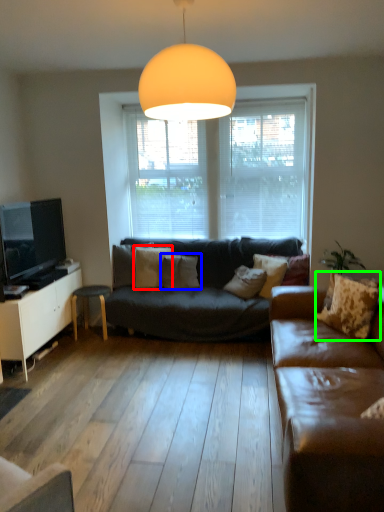
Question: Which object is the closest to the pillow (highlighted by a red box)? Choose among these: pillow (highlighted by a blue box) or pillow (highlighted by a green box).

Choices:
 (A) pillow
 (B) pillow

Answer: (A)